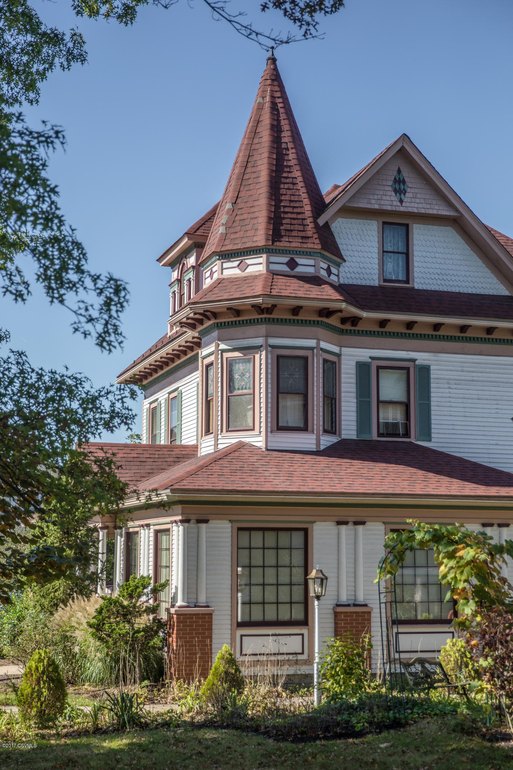
The image size is (513, 770). Find the location of `ground floor window - large made up of lots of panes`. ground floor window - large made up of lots of panes is located at coordinates (256, 581).